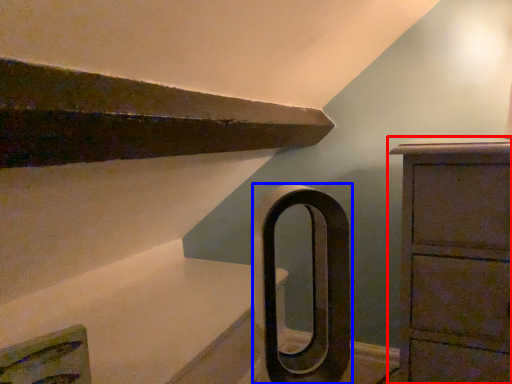
Question: Which object appears closest to the camera in this image, chest of drawers (highlighted by a red box) or door handle (highlighted by a blue box)?

Choices:
 (A) chest of drawers
 (B) door handle

Answer: (B)